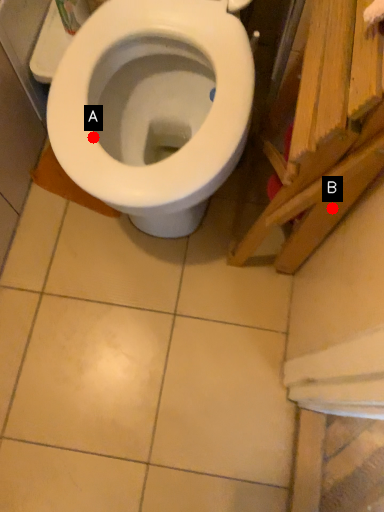
Question: Two points are circled on the image, labeled by A and B beside each circle. Which point appears closest to the camera in this image?

Choices:
 (A) A is closer
 (B) B is closer

Answer: (B)